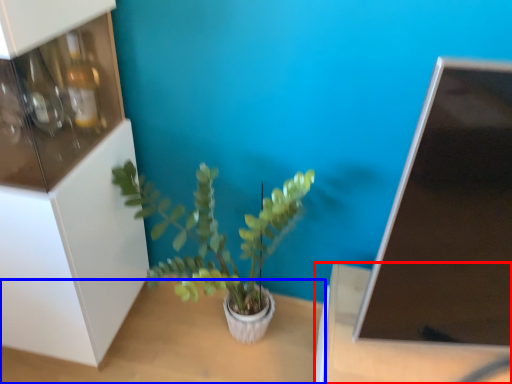
Question: Which object is closer to the camera taking this photo, table (highlighted by a red box) or table (highlighted by a blue box)?

Choices:
 (A) table
 (B) table

Answer: (A)